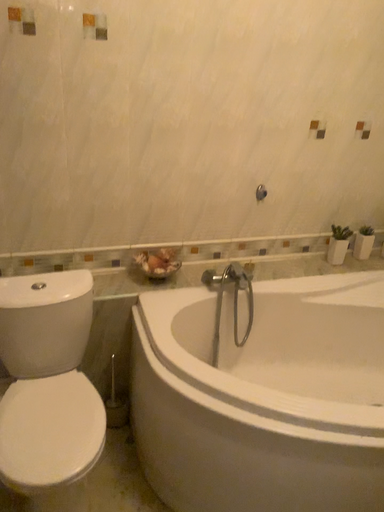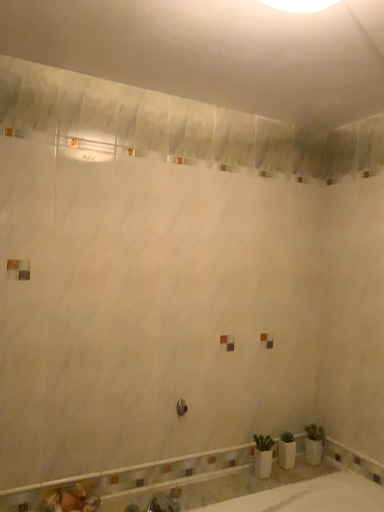
Question: How did the camera likely rotate when shooting the video?

Choices:
 (A) rotated downward
 (B) rotated upward

Answer: (B)